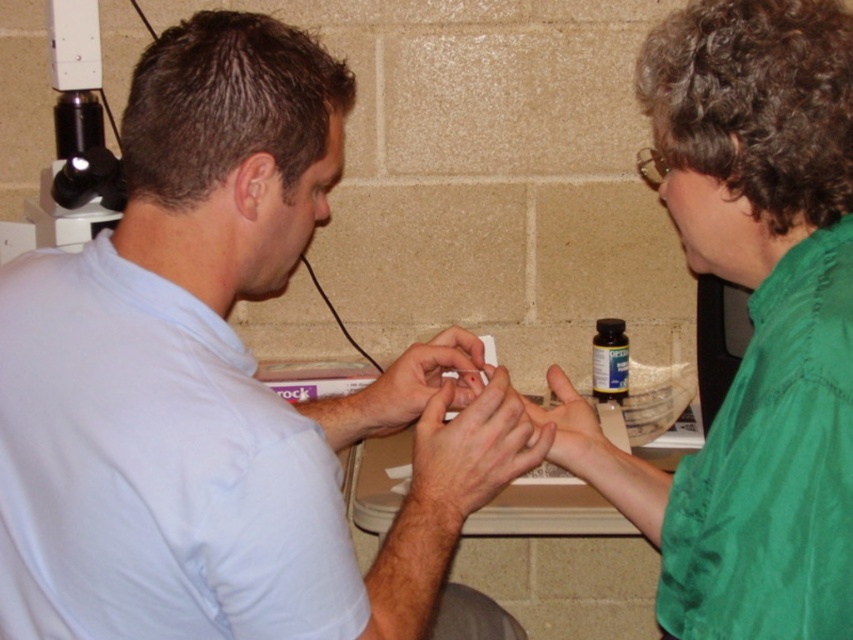
Question: Does green satin shirt at upper right appear on the left side of smooth skin at center?

Choices:
 (A) yes
 (B) no

Answer: (B)

Question: Which of the following is the farthest from the observer?

Choices:
 (A) smooth skin at center
 (B) green satin shirt at upper right

Answer: (A)

Question: Considering the relative positions of light blue shirt at center and green satin shirt at upper right in the image provided, where is light blue shirt at center located with respect to green satin shirt at upper right?

Choices:
 (A) right
 (B) left

Answer: (B)

Question: Considering the relative positions of light blue shirt at center and smooth skin at center in the image provided, where is light blue shirt at center located with respect to smooth skin at center?

Choices:
 (A) left
 (B) right

Answer: (A)

Question: Which point is farther to the camera?

Choices:
 (A) green matte hand at center
 (B) matte white hands at center
 (C) light blue shirt at center

Answer: (B)

Question: Which point appears closest to the camera in this image?

Choices:
 (A) (351, 548)
 (B) (412, 461)
 (C) (383, 422)
 (D) (601, 429)

Answer: (A)